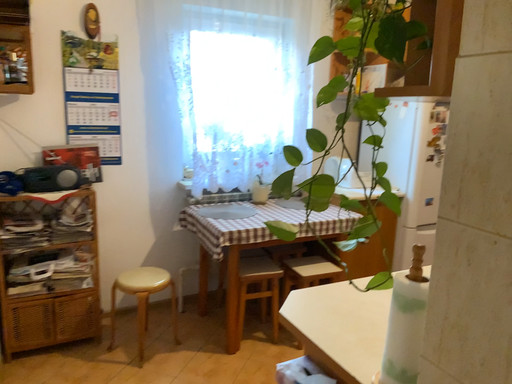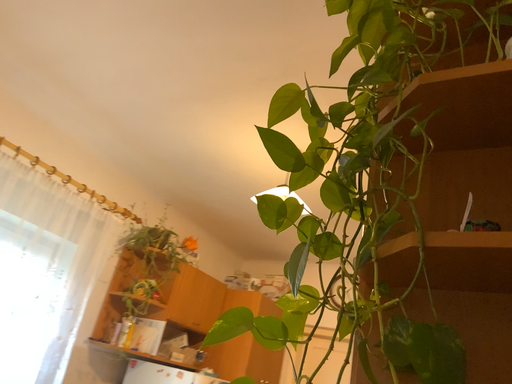
Question: How did the camera likely rotate when shooting the video?

Choices:
 (A) rotated left
 (B) rotated right

Answer: (B)